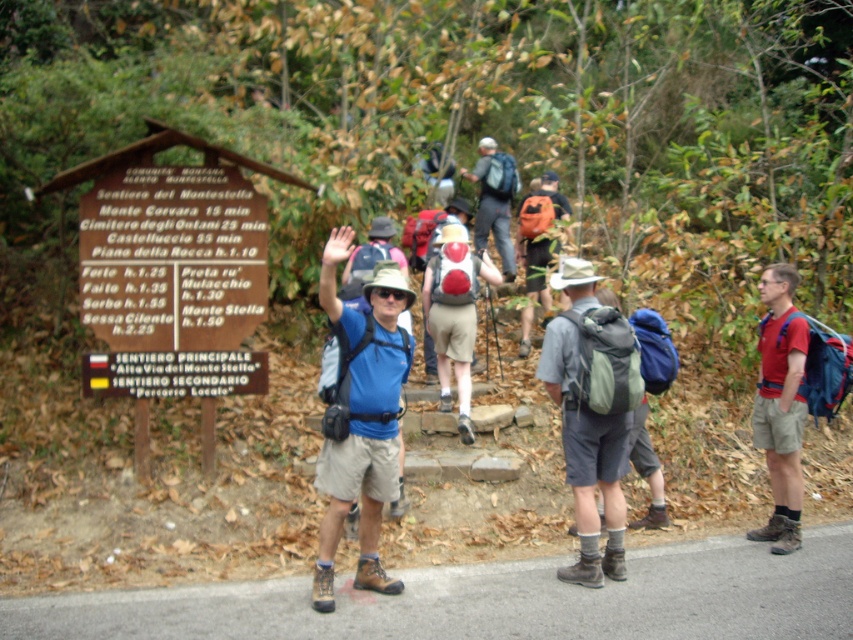
Does red fabric shirt at right have a lesser height compared to matte red backpack at center?

No, red fabric shirt at right is not shorter than matte red backpack at center.

Which is in front, point (766, 275) or point (440, 332)?

Point (766, 275) is in front.

What do you see at coordinates (780, 406) in the screenshot? The image size is (853, 640). I see `red fabric shirt at right` at bounding box center [780, 406].

Find the location of a particular element. red fabric shirt at right is located at coordinates (780, 406).

In the scene shown: Is brown wooden sign at upper center closer to the viewer compared to matte red backpack at center?

That is True.

Describe the element at coordinates (172, 276) in the screenshot. I see `brown wooden sign at upper center` at that location.

Image resolution: width=853 pixels, height=640 pixels. I want to click on brown wooden sign at upper center, so click(172, 276).

Image resolution: width=853 pixels, height=640 pixels. In order to click on brown leather boots at lower center in this screenshot , I will do [495, 600].

Is point (698, 602) positioned after point (463, 246)?

No, it is in front of (463, 246).

Where is `brown leather boots at lower center`? brown leather boots at lower center is located at coordinates (495, 600).